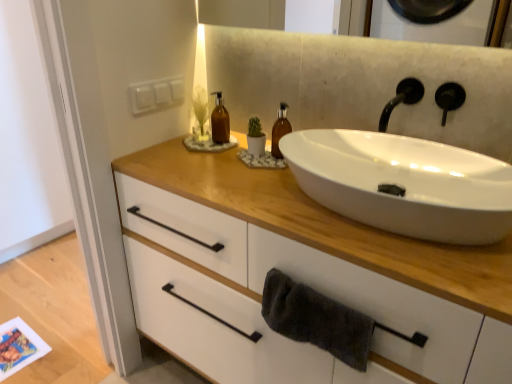
I want to click on free space to the left of white ceramic sink at center, so click(x=230, y=187).